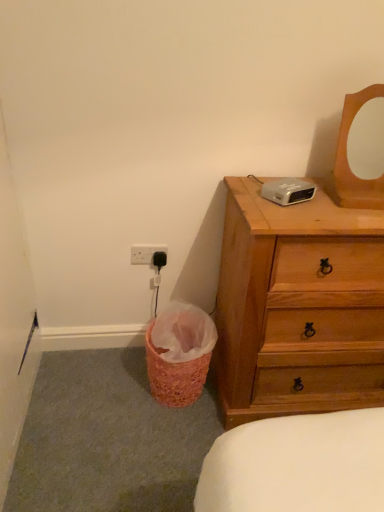
Question: Is pink woven basket at lower left closer to the viewer compared to wooden mirror at upper right?

Choices:
 (A) yes
 (B) no

Answer: (B)

Question: Does pink woven basket at lower left have a smaller size compared to wooden mirror at upper right?

Choices:
 (A) yes
 (B) no

Answer: (B)

Question: From a real-world perspective, is pink woven basket at lower left over wooden mirror at upper right?

Choices:
 (A) no
 (B) yes

Answer: (A)

Question: Is pink woven basket at lower left positioned with its back to wooden mirror at upper right?

Choices:
 (A) yes
 (B) no

Answer: (B)

Question: Does pink woven basket at lower left have a lesser height compared to wooden mirror at upper right?

Choices:
 (A) no
 (B) yes

Answer: (B)

Question: Is pink woven basket at lower left wider or thinner than wooden mirror at upper right?

Choices:
 (A) wide
 (B) thin

Answer: (A)

Question: Considering the positions of pink woven basket at lower left and wooden mirror at upper right in the image, is pink woven basket at lower left taller or shorter than wooden mirror at upper right?

Choices:
 (A) short
 (B) tall

Answer: (A)

Question: Based on their sizes in the image, would you say pink woven basket at lower left is bigger or smaller than wooden mirror at upper right?

Choices:
 (A) big
 (B) small

Answer: (A)

Question: From the image's perspective, is pink woven basket at lower left positioned above or below wooden mirror at upper right?

Choices:
 (A) below
 (B) above

Answer: (A)

Question: From a real-world perspective, is wooden chest of drawers at right physically located above or below pink woven basket at lower left?

Choices:
 (A) below
 (B) above

Answer: (B)

Question: From the image's perspective, relative to pink woven basket at lower left, is wooden chest of drawers at right above or below?

Choices:
 (A) below
 (B) above

Answer: (B)

Question: From their relative heights in the image, would you say wooden chest of drawers at right is taller or shorter than pink woven basket at lower left?

Choices:
 (A) tall
 (B) short

Answer: (A)

Question: Looking at their shapes, would you say wooden chest of drawers at right is wider or thinner than pink woven basket at lower left?

Choices:
 (A) thin
 (B) wide

Answer: (B)

Question: From the image's perspective, is wooden mirror at upper right located above or below wooden chest of drawers at right?

Choices:
 (A) above
 (B) below

Answer: (A)

Question: From a real-world perspective, is wooden mirror at upper right above or below wooden chest of drawers at right?

Choices:
 (A) above
 (B) below

Answer: (A)